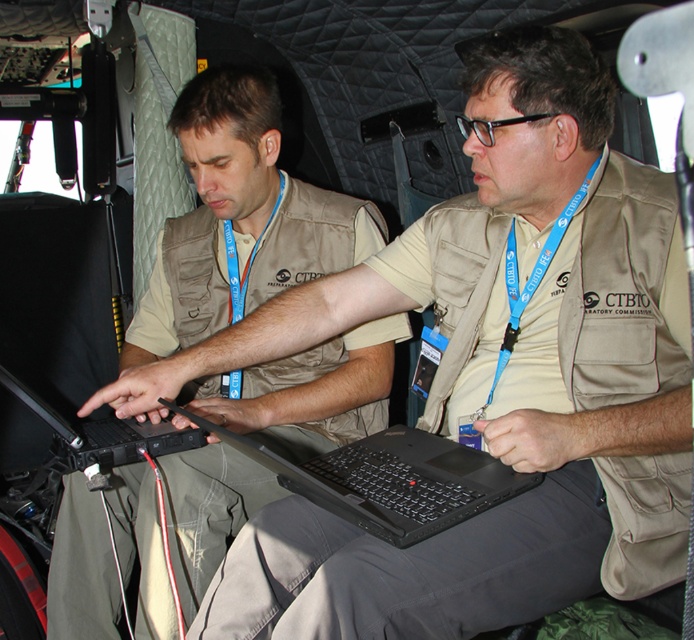
Who is shorter, matte khaki vest at center or black matte laptop at center?

Standing shorter between the two is black matte laptop at center.

Is matte khaki vest at center above black matte laptop at center?

Yes, matte khaki vest at center is above black matte laptop at center.

The width and height of the screenshot is (694, 640). What are the coordinates of `matte khaki vest at center` in the screenshot? It's located at (239, 218).

Locate an element on the screen. This screenshot has height=640, width=694. matte khaki vest at center is located at coordinates (239, 218).

Which is behind, point (330, 451) or point (16, 378)?

The point (16, 378) is behind.

Who is positioned more to the right, black plastic laptop at center or black matte laptop at center?

black plastic laptop at center

The height and width of the screenshot is (640, 694). Find the location of `black plastic laptop at center`. black plastic laptop at center is located at coordinates (389, 480).

Is blue fabric lanyard at center thinner than black matte laptop at center?

Correct, blue fabric lanyard at center's width is less than black matte laptop at center's.

Can you confirm if blue fabric lanyard at center is positioned to the left of black matte laptop at center?

Incorrect, blue fabric lanyard at center is not on the left side of black matte laptop at center.

Measure the distance between blue fabric lanyard at center and camera.

blue fabric lanyard at center is 3.50 feet from camera.

The width and height of the screenshot is (694, 640). In order to click on blue fabric lanyard at center in this screenshot , I will do `click(523, 330)`.